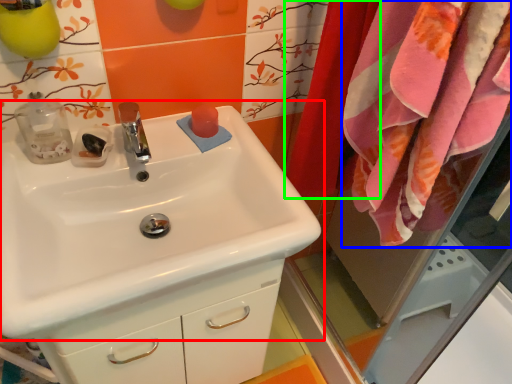
Question: Based on their relative distances, which object is farther from sink (highlighted by a red box)? Choose from bath towel (highlighted by a blue box) and curtain (highlighted by a green box).

Choices:
 (A) bath towel
 (B) curtain

Answer: (B)